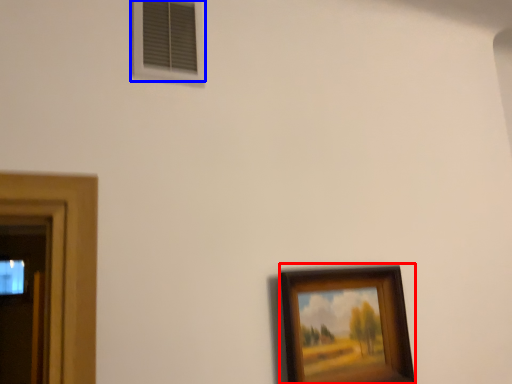
Question: Among these objects, which one is nearest to the camera, picture frame (highlighted by a red box) or window (highlighted by a blue box)?

Choices:
 (A) picture frame
 (B) window

Answer: (A)